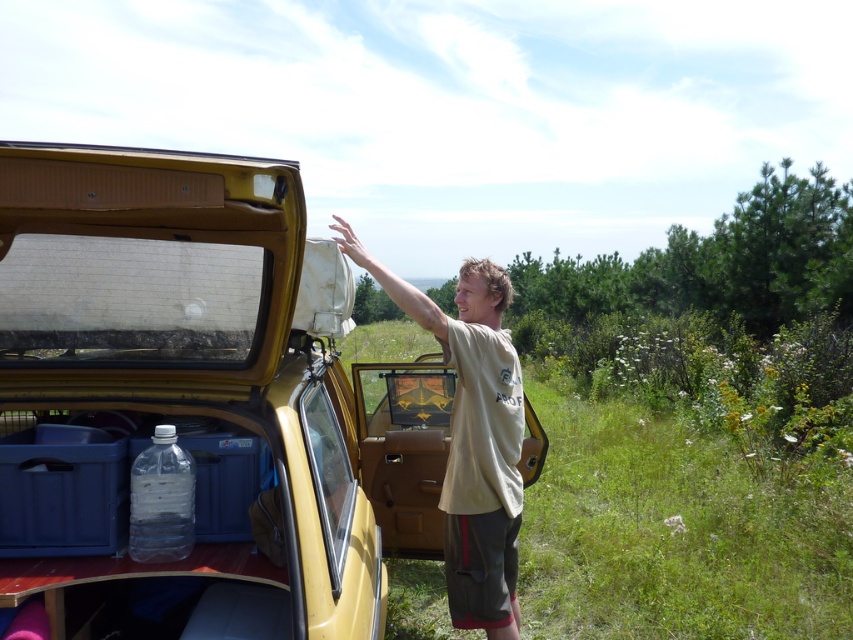
You are planning to load a large item into the yellow matte car at center and the clear plastic bottle at lower left. Based on their positions, which one is closer to the right side of the scene?

The yellow matte car at center is positioned on the right side of clear plastic bottle at lower left, so the yellow matte car at center is closer to the right side of the scene.

You are standing in front of the mustard yellow camper with the open rear hatch. There is a specific point marked at coordinates point (486,499). If you want to reach that point, how far will you have to walk from your current position?

The point (486,499) is 2.83 meters away from the viewer, so you will have to walk 2.83 meters to reach it.